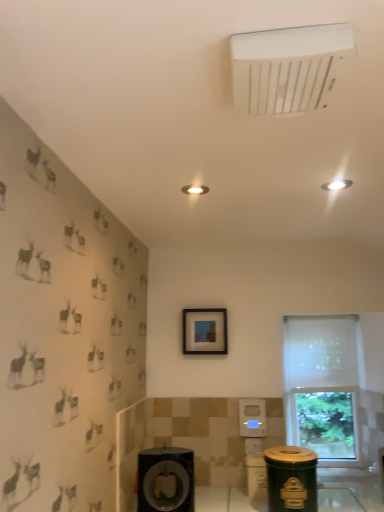
Question: Can you confirm if white sheer curtain at right is smaller than matte black picture frame at center?

Choices:
 (A) no
 (B) yes

Answer: (A)

Question: From the image's perspective, is white sheer curtain at right on matte black picture frame at center?

Choices:
 (A) yes
 (B) no

Answer: (B)

Question: Is white sheer curtain at right next to matte black picture frame at center?

Choices:
 (A) yes
 (B) no

Answer: (B)

Question: From a real-world perspective, is white sheer curtain at right beneath matte black picture frame at center?

Choices:
 (A) no
 (B) yes

Answer: (B)

Question: Is white sheer curtain at right not close to matte black picture frame at center?

Choices:
 (A) yes
 (B) no

Answer: (B)

Question: Considering the relative positions of white sheer curtain at right and matte black picture frame at center in the image provided, is white sheer curtain at right to the left of matte black picture frame at center from the viewer's perspective?

Choices:
 (A) yes
 (B) no

Answer: (B)

Question: Could you tell me if green matte trash can at lower right is turned towards matte black picture frame at center?

Choices:
 (A) no
 (B) yes

Answer: (A)

Question: Does green matte trash can at lower right appear on the left side of matte black picture frame at center?

Choices:
 (A) yes
 (B) no

Answer: (B)

Question: From the image's perspective, would you say green matte trash can at lower right is shown under matte black picture frame at center?

Choices:
 (A) yes
 (B) no

Answer: (A)

Question: Can you confirm if green matte trash can at lower right is smaller than matte black picture frame at center?

Choices:
 (A) yes
 (B) no

Answer: (B)

Question: Is green matte trash can at lower right closer to the viewer compared to matte black picture frame at center?

Choices:
 (A) no
 (B) yes

Answer: (B)

Question: Is green matte trash can at lower right to the right of matte black picture frame at center from the viewer's perspective?

Choices:
 (A) yes
 (B) no

Answer: (A)

Question: Is white sheer curtain at right at the left side of white plastic air conditioning unit at upper center?

Choices:
 (A) no
 (B) yes

Answer: (A)